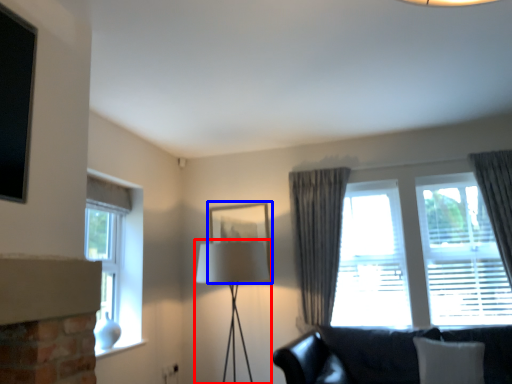
Question: Which of the following is the closest to the observer, table lamp (highlighted by a red box) or picture frame (highlighted by a blue box)?

Choices:
 (A) table lamp
 (B) picture frame

Answer: (A)